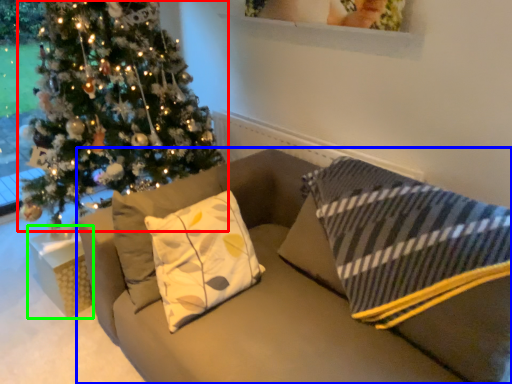
Question: Which is farther away from christmas tree (highlighted by a red box)? studio couch (highlighted by a blue box) or furniture (highlighted by a green box)?

Choices:
 (A) studio couch
 (B) furniture

Answer: (A)